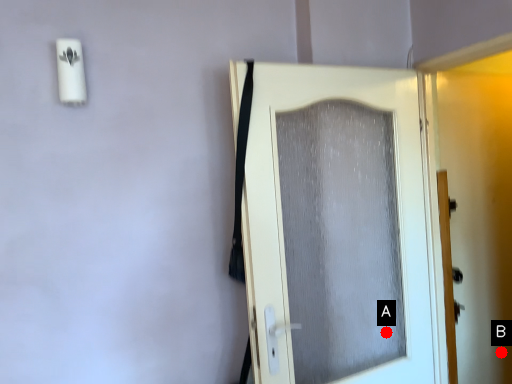
Question: Two points are circled on the image, labeled by A and B beside each circle. Which point is farther from the camera taking this photo?

Choices:
 (A) A is further
 (B) B is further

Answer: (B)